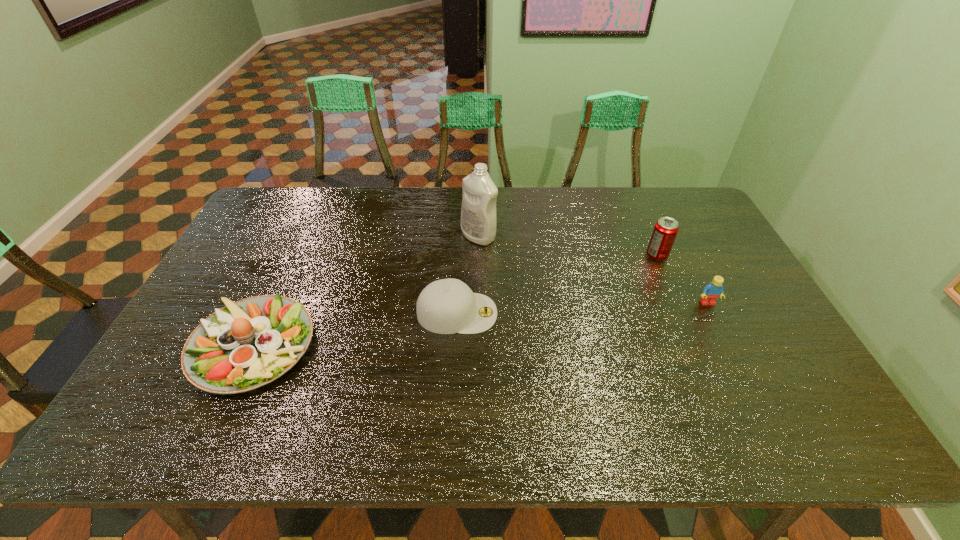
In the image, there is a desktop. Where is `blank space at the near right corner`? The height and width of the screenshot is (540, 960). blank space at the near right corner is located at coordinates (838, 440).

Locate an element on the screen. The height and width of the screenshot is (540, 960). free space between the Lego and the tallest object is located at coordinates (593, 269).

The height and width of the screenshot is (540, 960). I want to click on empty space between the tallest object and the rightmost object, so click(x=593, y=269).

At what (x,y) coordinates should I click in order to perform the action: click on free area in between the cap and the detergent. Please return your answer as a coordinate pair (x, y). The image size is (960, 540). Looking at the image, I should click on (468, 275).

In order to click on vacant area between the salad plate and the cap in this screenshot , I will do `click(355, 329)`.

Where is `vacant region between the cap and the second object from right to left`? vacant region between the cap and the second object from right to left is located at coordinates click(x=557, y=284).

Identify which object is located as the fourth nearest to the leftmost object. Please provide its 2D coordinates. Your answer should be formatted as a tuple, i.e. [(x, y)], where the tuple contains the x and y coordinates of a point satisfying the conditions above.

[(714, 289)]

Locate an element on the screen. This screenshot has width=960, height=540. object that is the second closest to the salad plate is located at coordinates (478, 211).

Find the location of a particular element. This screenshot has height=540, width=960. free space that satisfies the following two spatial constraints: 1. on the front side of the soda can; 2. on the front-facing side of the cap is located at coordinates (682, 313).

You are a GUI agent. You are given a task and a screenshot of the screen. Output one action in this format:
    pyautogui.click(x=<x>, y=<y>)
    Task: Click on the free space that satisfies the following two spatial constraints: 1. on the front side of the soda can; 2. on the front-facing side of the cap
    Image resolution: width=960 pixels, height=540 pixels.
    Given the screenshot: What is the action you would take?
    pyautogui.click(x=682, y=313)